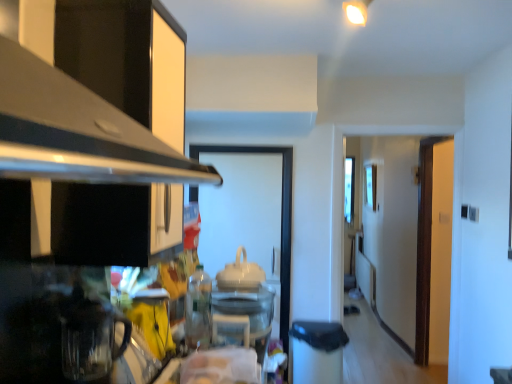
What do you see at coordinates (153, 320) in the screenshot? The width and height of the screenshot is (512, 384). I see `yellow matte mug at lower left, which is counted as the 2th appliance, starting from the left` at bounding box center [153, 320].

The width and height of the screenshot is (512, 384). Describe the element at coordinates (90, 338) in the screenshot. I see `transparent glass coffee pot at lower left, the first appliance viewed from the front` at that location.

I want to click on black metallic exhaust hood at upper left, so click(77, 132).

What is the approximate height of brown wooden door at right?

brown wooden door at right is 2.03 meters tall.

The height and width of the screenshot is (384, 512). What are the coordinates of `yellow matte mug at lower left, placed as the 3th appliance when sorted from back to front` in the screenshot? It's located at (153, 320).

Is white glossy teapot at center, positioned as the first appliance in right-to-left order, in front of or behind transparent glass coffee pot at lower left, the first appliance viewed from the front, in the image?

In the image, white glossy teapot at center, positioned as the first appliance in right-to-left order, appears behind transparent glass coffee pot at lower left, the first appliance viewed from the front.

Identify the location of the 2nd appliance above when counting from the transparent glass coffee pot at lower left, the 4th appliance from the back (from the image's perspective). The image size is (512, 384). pos(240,274).

Is white glossy teapot at center, which appears as the 4th appliance when viewed from the front, wider or thinner than transparent glass coffee pot at lower left, the first appliance viewed from the left?

Clearly, white glossy teapot at center, which appears as the 4th appliance when viewed from the front, has more width compared to transparent glass coffee pot at lower left, the first appliance viewed from the left.

Would you say white glossy teapot at center, which appears as the 4th appliance when viewed from the front, contains transparent glass coffee pot at lower left, the first appliance viewed from the front?

No, transparent glass coffee pot at lower left, the first appliance viewed from the front, is not surrounded by white glossy teapot at center, which appears as the 4th appliance when viewed from the front.

Considering the sizes of objects yellow matte mug at lower left, which is the 3th appliance in right-to-left order, and clear plastic bottle at lower center, marked as the second appliance in a back-to-front arrangement, in the image provided, who is taller, yellow matte mug at lower left, which is the 3th appliance in right-to-left order, or clear plastic bottle at lower center, marked as the second appliance in a back-to-front arrangement,?

clear plastic bottle at lower center, marked as the second appliance in a back-to-front arrangement.

From the image's perspective, which is above, yellow matte mug at lower left, placed as the 3th appliance when sorted from back to front, or clear plastic bottle at lower center, which is the 3th appliance from left to right?

clear plastic bottle at lower center, which is the 3th appliance from left to right, appears higher in the image.

From a real-world perspective, is yellow matte mug at lower left, placed as the 3th appliance when sorted from back to front, on clear plastic bottle at lower center, marked as the second appliance in a back-to-front arrangement?

No, from a real-world perspective, yellow matte mug at lower left, placed as the 3th appliance when sorted from back to front, is not over clear plastic bottle at lower center, marked as the second appliance in a back-to-front arrangement

Considering the positions of objects yellow matte mug at lower left, which is counted as the 2th appliance, starting from the left, and clear plastic bottle at lower center, the 2th appliance when ordered from right to left, in the image provided, who is more to the right, yellow matte mug at lower left, which is counted as the 2th appliance, starting from the left, or clear plastic bottle at lower center, the 2th appliance when ordered from right to left,?

clear plastic bottle at lower center, the 2th appliance when ordered from right to left.

Is transparent glass coffee pot at lower left, the first appliance viewed from the left, not within brown wooden door at right?

Yes, transparent glass coffee pot at lower left, the first appliance viewed from the left, is outside of brown wooden door at right.

Which is nearer, (65, 369) or (434, 213)?

Point (65, 369).

Based on their positions, is transparent glass coffee pot at lower left, the 4th appliance from the back, located to the left or right of brown wooden door at right?

Result: transparent glass coffee pot at lower left, the 4th appliance from the back, is to the left of brown wooden door at right.

Consider the image. Looking at the image, does transparent glass coffee pot at lower left, the 4th appliance when ordered from right to left, seem bigger or smaller compared to brown wooden door at right?

transparent glass coffee pot at lower left, the 4th appliance when ordered from right to left, is smaller than brown wooden door at right.

Find the location of a particular element. exhaust hood on the left of the brown wooden door at right is located at coordinates (77, 132).

Considering the sizes of objects brown wooden door at right and black metallic exhaust hood at upper left in the image provided, who is wider, brown wooden door at right or black metallic exhaust hood at upper left?

black metallic exhaust hood at upper left.

Can you tell me how much brown wooden door at right and black metallic exhaust hood at upper left differ in facing direction?

2.95 degrees separate the facing orientations of brown wooden door at right and black metallic exhaust hood at upper left.

Is brown wooden door at right beside black metallic exhaust hood at upper left?

brown wooden door at right is not next to black metallic exhaust hood at upper left, and they're not touching.

From a real-world perspective, who is located lower, black metallic exhaust hood at upper left or transparent glass coffee pot at lower left, the 4th appliance when ordered from right to left?

transparent glass coffee pot at lower left, the 4th appliance when ordered from right to left, is physically lower.

Considering the relative positions of black metallic exhaust hood at upper left and transparent glass coffee pot at lower left, the 4th appliance from the back, in the image provided, is black metallic exhaust hood at upper left to the left or to the right of transparent glass coffee pot at lower left, the 4th appliance from the back,?

In the image, black metallic exhaust hood at upper left appears on the right side of transparent glass coffee pot at lower left, the 4th appliance from the back.

Is black metallic exhaust hood at upper left looking in the opposite direction of transparent glass coffee pot at lower left, the first appliance viewed from the front?

No, black metallic exhaust hood at upper left is not facing away from transparent glass coffee pot at lower left, the first appliance viewed from the front.

From the image's perspective, does black metallic exhaust hood at upper left appear lower than white glossy teapot at center, which appears as the 4th appliance when viewed from the front?

No.

Identify the location of exhaust hood on the left of white glossy teapot at center, positioned as the first appliance in right-to-left order. Image resolution: width=512 pixels, height=384 pixels. (77, 132).

Does black metallic exhaust hood at upper left have a greater height compared to white glossy teapot at center, acting as the fourth appliance starting from the left?

Yes, black metallic exhaust hood at upper left is taller than white glossy teapot at center, acting as the fourth appliance starting from the left.

In the scene shown: From a real-world perspective, is black metallic exhaust hood at upper left beneath white glossy teapot at center, acting as the fourth appliance starting from the left?

No, from a real-world perspective, black metallic exhaust hood at upper left is not beneath white glossy teapot at center, acting as the fourth appliance starting from the left.

Consider the image. Which is less distant, (246, 279) or (170, 341)?

Point (246, 279) is positioned farther from the camera compared to point (170, 341).

Is white glossy teapot at center, acting as the fourth appliance starting from the left, wider than yellow matte mug at lower left, which is counted as the 2th appliance, starting from the left?

Indeed, white glossy teapot at center, acting as the fourth appliance starting from the left, has a greater width compared to yellow matte mug at lower left, which is counted as the 2th appliance, starting from the left.

Between white glossy teapot at center, positioned as the first appliance in right-to-left order, and yellow matte mug at lower left, which is the 3th appliance in right-to-left order, which one has less height?

white glossy teapot at center, positioned as the first appliance in right-to-left order, is shorter.

From the image's perspective, is white glossy teapot at center, acting as the fourth appliance starting from the left, located above yellow matte mug at lower left, which is the 3th appliance in right-to-left order?

Indeed, from the image's perspective, white glossy teapot at center, acting as the fourth appliance starting from the left, is shown above yellow matte mug at lower left, which is the 3th appliance in right-to-left order.

This screenshot has width=512, height=384. Identify the location of appliance that is the 2nd object above the transparent glass coffee pot at lower left, the first appliance viewed from the left (from a real-world perspective). (240, 274).

This screenshot has width=512, height=384. Find the location of `the 1st appliance to the right of the yellow matte mug at lower left, which appears as the 2th appliance when viewed from the front, starting your count from the anchor`. the 1st appliance to the right of the yellow matte mug at lower left, which appears as the 2th appliance when viewed from the front, starting your count from the anchor is located at coordinates (x=198, y=310).

From the image, which object appears to be nearer to clear plastic bottle at lower center, the 2th appliance when ordered from right to left, white glossy teapot at center, which appears as the 4th appliance when viewed from the front, or black metallic exhaust hood at upper left?

Among the two, white glossy teapot at center, which appears as the 4th appliance when viewed from the front, is located nearer to clear plastic bottle at lower center, the 2th appliance when ordered from right to left.

Looking at the image, which one is located further to white glossy teapot at center, positioned as the 1th appliance in back-to-front order, clear plastic bottle at lower center, which is the 3th appliance from left to right, or yellow matte mug at lower left, which is the 3th appliance in right-to-left order?

yellow matte mug at lower left, which is the 3th appliance in right-to-left order, is positioned further to the anchor white glossy teapot at center, positioned as the 1th appliance in back-to-front order.

Considering their positions, is white glossy teapot at center, acting as the fourth appliance starting from the left, positioned closer to brown wooden door at right than black metallic exhaust hood at upper left?

white glossy teapot at center, acting as the fourth appliance starting from the left, is positioned closer to the anchor brown wooden door at right.

Based on their spatial positions, is transparent glass door at center or black metallic exhaust hood at upper left further from brown wooden door at right?

Among the two, black metallic exhaust hood at upper left is located further to brown wooden door at right.

When comparing their distances from black metallic exhaust hood at upper left, does clear plastic bottle at lower center, which is counted as the third appliance, starting from the front, or transparent glass door at center seem closer?

clear plastic bottle at lower center, which is counted as the third appliance, starting from the front, is positioned closer to the anchor black metallic exhaust hood at upper left.

Based on their spatial positions, is yellow matte mug at lower left, placed as the 3th appliance when sorted from back to front, or brown wooden door at right closer to clear plastic bottle at lower center, the 2th appliance when ordered from right to left?

yellow matte mug at lower left, placed as the 3th appliance when sorted from back to front, lies closer to clear plastic bottle at lower center, the 2th appliance when ordered from right to left, than the other object.

From the picture: Considering their positions, is clear plastic bottle at lower center, the 2th appliance when ordered from right to left, positioned further to brown wooden door at right than transparent glass coffee pot at lower left, the first appliance viewed from the left?

transparent glass coffee pot at lower left, the first appliance viewed from the left, lies further to brown wooden door at right than the other object.

Estimate the real-world distances between objects in this image. Which object is further from transparent glass coffee pot at lower left, the 4th appliance from the back, transparent glass door at center or clear plastic bottle at lower center, which is counted as the third appliance, starting from the front?

transparent glass door at center is further to transparent glass coffee pot at lower left, the 4th appliance from the back.

Image resolution: width=512 pixels, height=384 pixels. Find the location of `glass door situated between yellow matte mug at lower left, which is counted as the 2th appliance, starting from the left, and brown wooden door at right from left to right`. glass door situated between yellow matte mug at lower left, which is counted as the 2th appliance, starting from the left, and brown wooden door at right from left to right is located at coordinates (281, 217).

Where is `appliance between transparent glass door at center and brown wooden door at right`? appliance between transparent glass door at center and brown wooden door at right is located at coordinates (240, 274).

Identify the location of appliance between transparent glass coffee pot at lower left, the 4th appliance from the back, and clear plastic bottle at lower center, which is the 3th appliance from left to right, from front to back. (153, 320).

Identify the location of appliance between clear plastic bottle at lower center, which is the 3th appliance from left to right, and transparent glass door at center, along the z-axis. (240, 274).